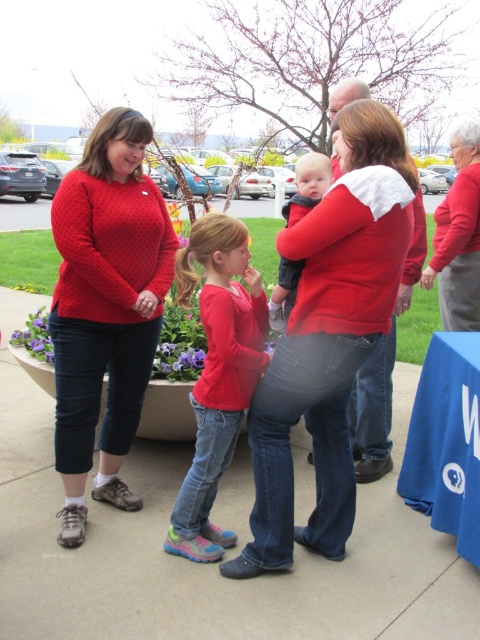
Is matte red shirt at center positioned in front of matte red sweater at center?

No.

Which is more to the right, matte red shirt at center or matte red sweater at center?

matte red sweater at center is more to the right.

I want to click on matte red shirt at center, so click(217, 374).

Where is `matte red shirt at center`? matte red shirt at center is located at coordinates (217, 374).

Who is more forward, [422,202] or [459,285]?

Point [422,202] is more forward.

Is point (352, 88) farther from camera compared to point (466, 154)?

No, it is in front of (466, 154).

The image size is (480, 640). In order to click on matte red sweater at center in this screenshot , I will do `click(384, 368)`.

Consider the image. Is knitted red sweater at left above matte red sweater at center?

Indeed, knitted red sweater at left is positioned over matte red sweater at center.

Who is more distant from viewer, (135, 276) or (372, 422)?

Point (372, 422)

Identify the location of knitted red sweater at left. This screenshot has width=480, height=640. (106, 308).